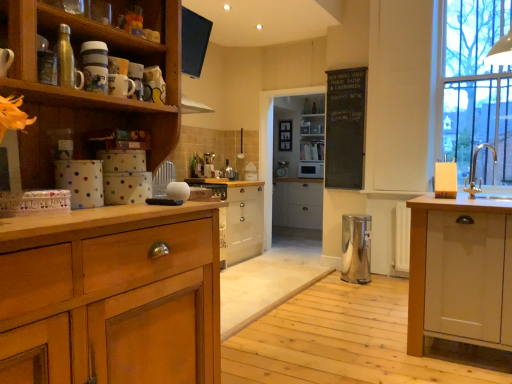
Where is `empty space that is ontop of black chalkboard at upper center`? empty space that is ontop of black chalkboard at upper center is located at coordinates (343, 69).